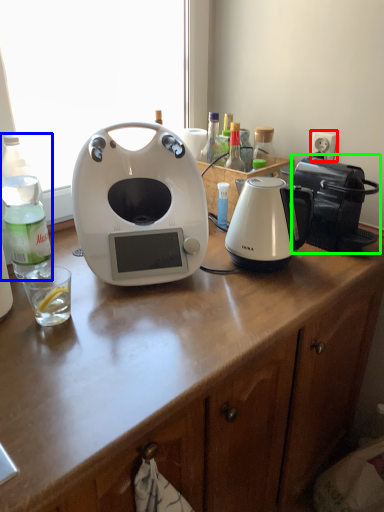
Question: Based on their relative distances, which object is nearer to power outlet (highlighted by a red box)? Choose from bottle (highlighted by a blue box) and toaster (highlighted by a green box).

Choices:
 (A) bottle
 (B) toaster

Answer: (B)